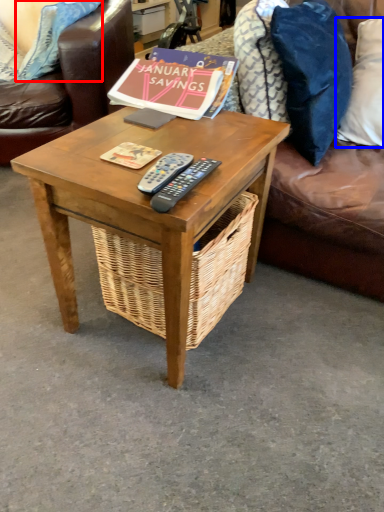
Question: Which object is further to the camera taking this photo, pillow (highlighted by a red box) or pillow (highlighted by a blue box)?

Choices:
 (A) pillow
 (B) pillow

Answer: (A)